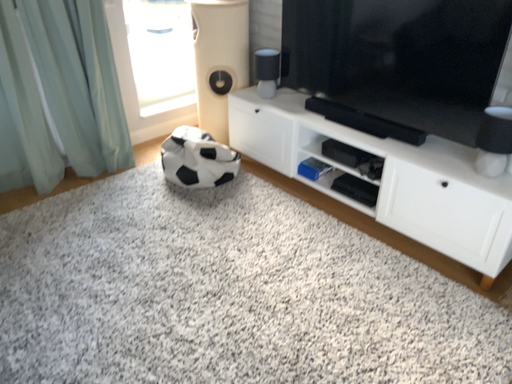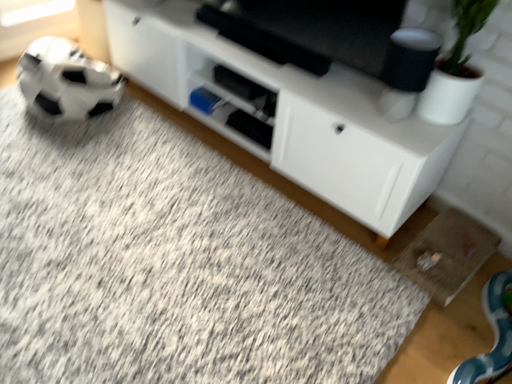
Question: How did the camera likely rotate when shooting the video?

Choices:
 (A) rotated right
 (B) rotated left

Answer: (A)